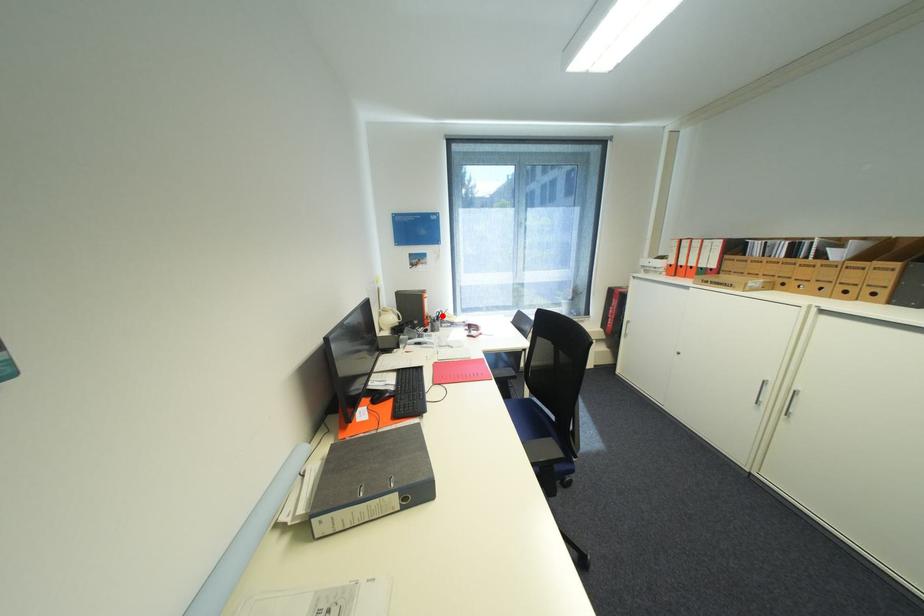
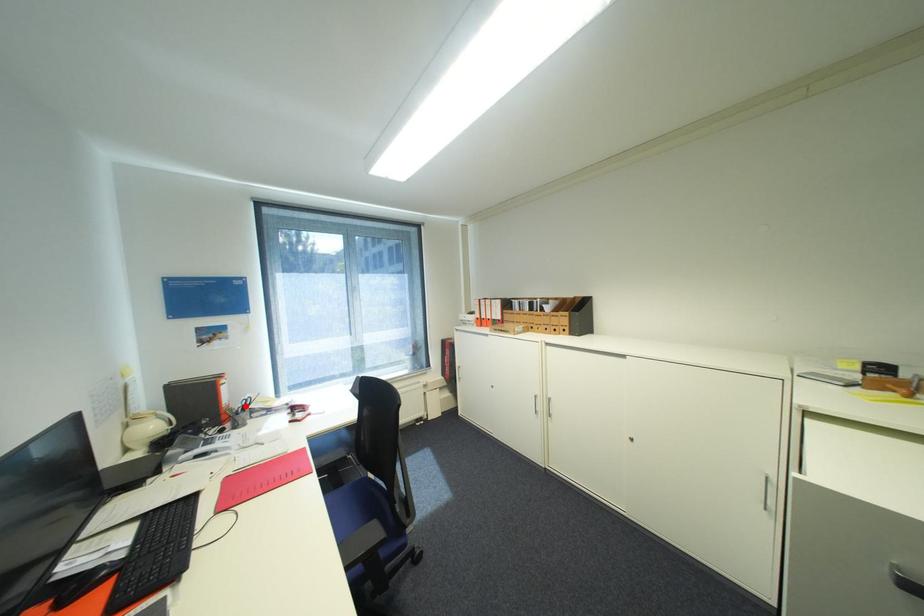
I am providing you with two images of the same scene from different viewpoints. A red point is marked on the first image and another point is marked on the second image. Do the highlighted points in image1 and image2 indicate the same real-world spot?

Yes